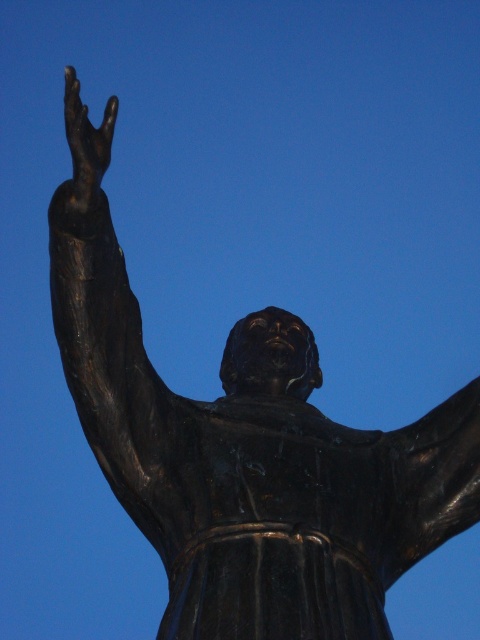
You are an art restorer examining the statue. You need to clean the black polished statue arm at upper left and the black polished hand at upper left. Which part should you clean first if you want to avoid getting the already cleaned area dirty again?

The black polished statue arm at upper left is in front of the black polished hand at upper left, so you should clean the black polished hand at upper left first to prevent the arm from dripping onto the hand after cleaning.

You are an art student analyzing the statue. You notice two parts of the statue at the upper left corner. One is labeled as the black polished statue arm at upper left and the other is the black polished hand at upper left. Which of these two parts is taller?

The black polished statue arm at upper left is much taller than the black polished hand at upper left.

You are an art student analyzing the statue in the image. You notice two parts of the statue at the upper left corner. Which one is larger in size between the black polished statue arm at upper left and the black polished hand at upper left?

The black polished statue arm at upper left is bigger than the black polished hand at upper left.